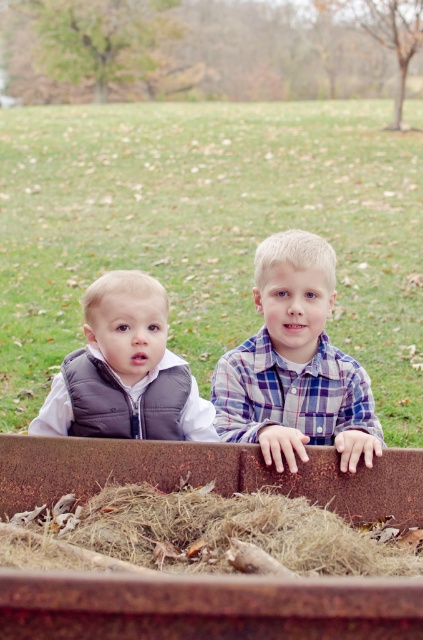
Question: Can you confirm if brown dry hay at center is positioned to the right of matte gray vest at left?

Choices:
 (A) yes
 (B) no

Answer: (A)

Question: Can you confirm if blue plaid shirt at center is wider than matte gray vest at left?

Choices:
 (A) yes
 (B) no

Answer: (B)

Question: Does brown dry hay at center appear over blue plaid shirt at center?

Choices:
 (A) yes
 (B) no

Answer: (B)

Question: Based on their relative distances, which object is nearer to the blue plaid shirt at center?

Choices:
 (A) brown dry hay at center
 (B) matte gray vest at left

Answer: (B)

Question: Which point is closer to the camera?

Choices:
 (A) brown dry hay at center
 (B) blue plaid shirt at center
 (C) matte gray vest at left

Answer: (A)

Question: Which point is farther from the camera taking this photo?

Choices:
 (A) (120, 324)
 (B) (371, 532)

Answer: (A)